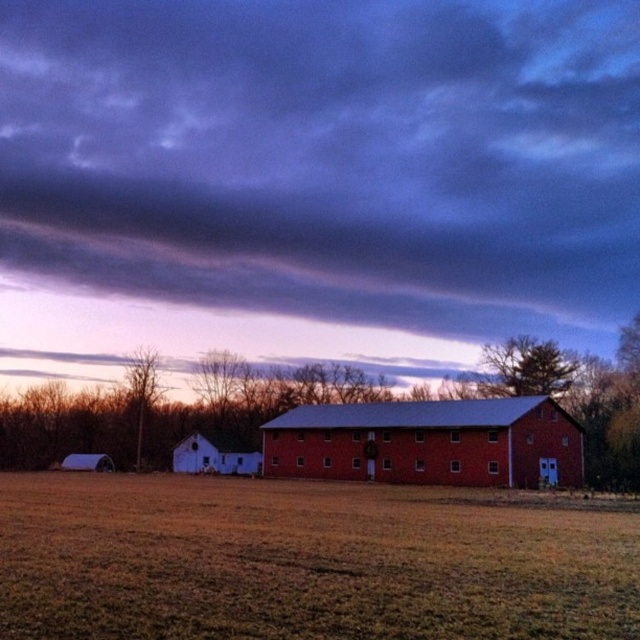
You are a farmer checking the weather forecast. You see the dark purple cloud at upper center and the white matte barn at center. Which object is located above the other?

The dark purple cloud at upper center is positioned over the white matte barn at center, so the dark purple cloud at upper center is above the white matte barn at center.

You are an artist planning to paint the scene. You want to ensure the dark purple cloud at upper center and the white matte barn at center are proportionally accurate. Which object should you make wider in your painting?

The dark purple cloud at upper center should be made wider in the painting since its width surpasses that of the white matte barn at center according to the description.

You are standing in the rural scene and want to determine which of the two points, point [484,435] or point [234,452], is nearer to you. Based on the image, which point is closer?

Point [484,435] is closer to the camera than point [234,452], so it is the nearer point.